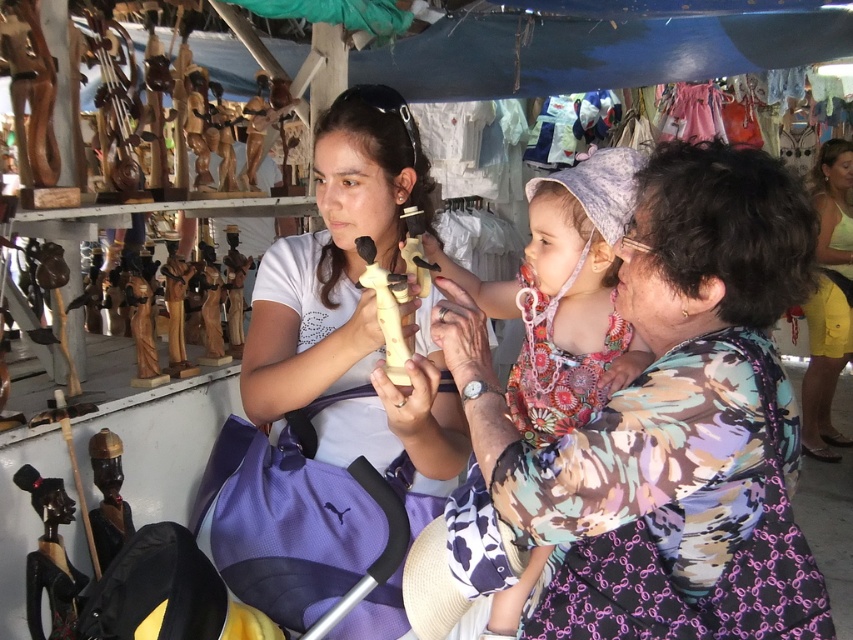
Question: Can you confirm if matte white statue at center is positioned to the right of yellow cotton shorts at lower right?

Choices:
 (A) no
 (B) yes

Answer: (A)

Question: Can you confirm if floral print dress at center is positioned above yellow cotton shorts at lower right?

Choices:
 (A) no
 (B) yes

Answer: (A)

Question: Which of the following is the farthest from the observer?

Choices:
 (A) (126, 529)
 (B) (447, 458)
 (C) (647, 474)

Answer: (A)

Question: Based on their relative distances, which object is nearer to the matte white statue at center?

Choices:
 (A) yellow cotton shorts at lower right
 (B) floral print dress at center

Answer: (B)

Question: Can you confirm if yellow cotton shorts at lower right is thinner than wooden figurine at lower left?

Choices:
 (A) no
 (B) yes

Answer: (A)

Question: Among these objects, which one is farthest from the camera?

Choices:
 (A) matte white statue at center
 (B) yellow cotton shorts at lower right
 (C) wooden figurine at lower left
 (D) floral print dress at center

Answer: (B)